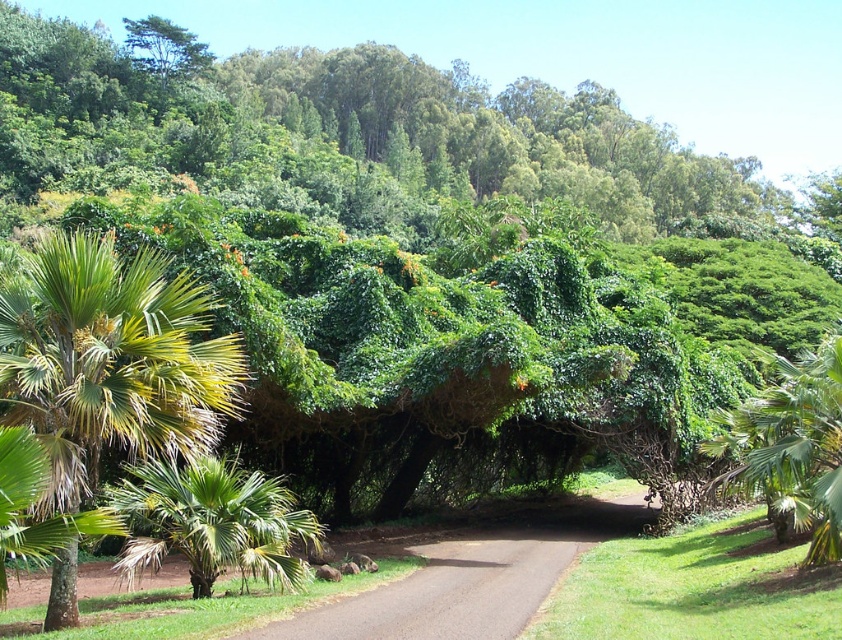
Is green leafy palm at left smaller than green leafy palm tree at lower left?

Yes, green leafy palm at left is smaller than green leafy palm tree at lower left.

Describe the element at coordinates (110, 358) in the screenshot. I see `green leafy palm at left` at that location.

Locate an element on the screen. green leafy palm at left is located at coordinates (110, 358).

At what (x,y) coordinates should I click in order to perform the action: click on green leafy palm at left. Please return your answer as a coordinate pair (x, y). Looking at the image, I should click on (110, 358).

The height and width of the screenshot is (640, 842). Describe the element at coordinates (110, 358) in the screenshot. I see `green leafy palm at left` at that location.

This screenshot has height=640, width=842. Find the location of `green leafy palm at left`. green leafy palm at left is located at coordinates (110, 358).

Is point (226, 531) in front of point (803, 376)?

That is True.

Between point (280, 577) and point (768, 454), which one is positioned behind?

The point (280, 577) is behind.

Between point (144, 497) and point (822, 540), which one is positioned in front?

Point (144, 497) is more forward.

Find the location of a particular element. Image resolution: width=842 pixels, height=640 pixels. green leafy palm tree at lower left is located at coordinates [212, 524].